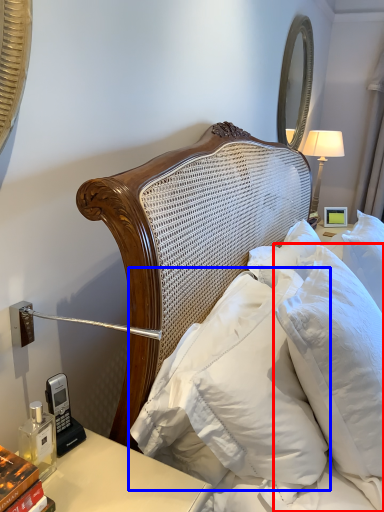
Question: Which object appears closest to the camera in this image, pillow (highlighted by a red box) or pillow (highlighted by a blue box)?

Choices:
 (A) pillow
 (B) pillow

Answer: (A)